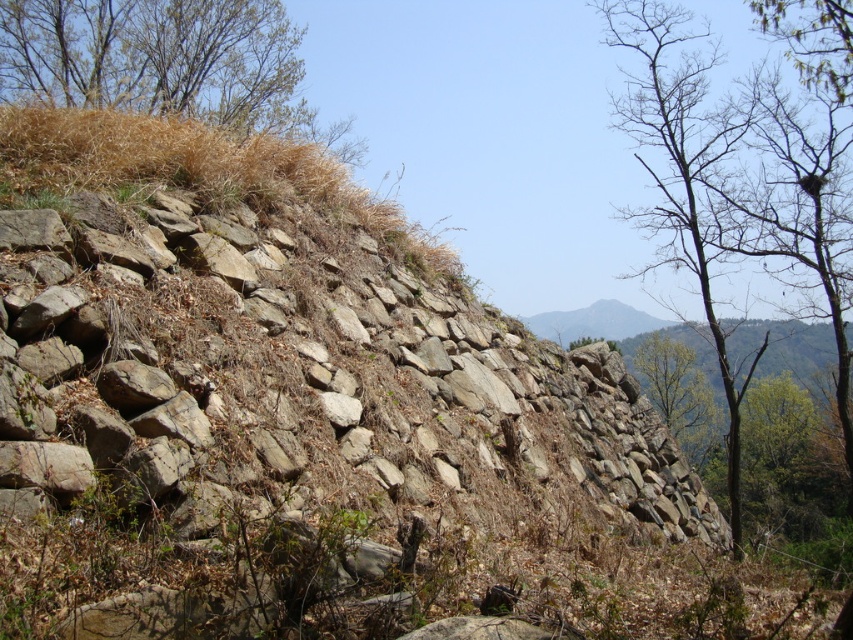
You are a hiker standing at the base of the ancient stone wall and want to reach the top. You notice the brown grass at upper left and the bare branches at upper right. Which feature is closer to you as you climb?

The brown grass at upper left is closer to you because it is further to the viewer than the bare branches at upper right, meaning it appears nearer in the scene.